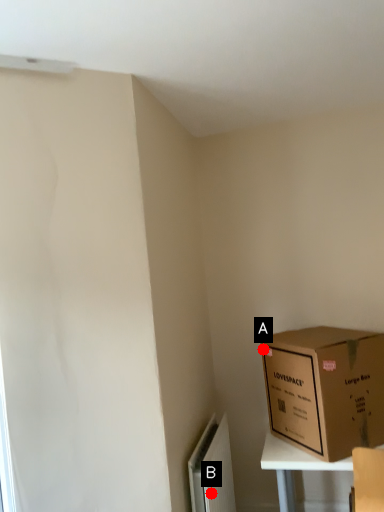
Question: Two points are circled on the image, labeled by A and B beside each circle. Which point is closer to the camera?

Choices:
 (A) A is closer
 (B) B is closer

Answer: (B)